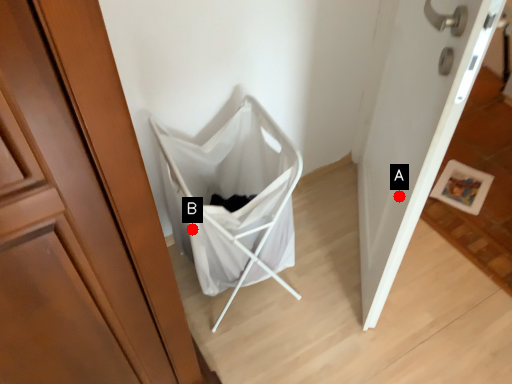
Question: Two points are circled on the image, labeled by A and B beside each circle. Which point is closer to the camera?

Choices:
 (A) A is closer
 (B) B is closer

Answer: (A)